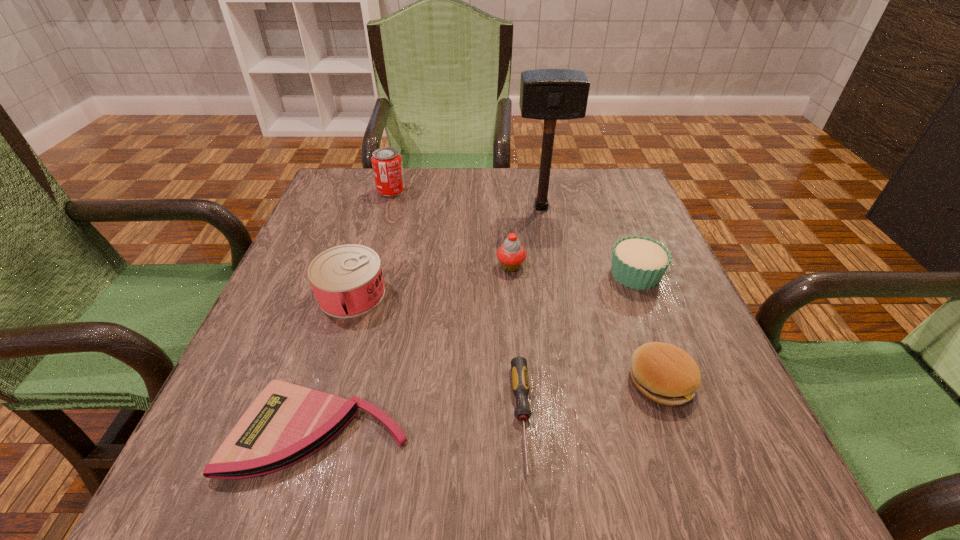
Where is `the tallest object`? the tallest object is located at coordinates (545, 94).

This screenshot has height=540, width=960. Find the location of `mallet`. mallet is located at coordinates (545, 94).

Find the location of `the seventh shortest object`. the seventh shortest object is located at coordinates (387, 165).

Locate an element on the screen. the taller can is located at coordinates (387, 165).

This screenshot has width=960, height=540. I want to click on the taller cupcake, so click(511, 254).

At what (x,y) coordinates should I click in order to perform the action: click on the nearer can. Please return your answer as a coordinate pair (x, y). Looking at the image, I should click on (347, 281).

At what (x,y) coordinates should I click in order to perform the action: click on the right cupcake. Please return your answer as a coordinate pair (x, y). Looking at the image, I should click on (638, 262).

You are a GUI agent. You are given a task and a screenshot of the screen. Output one action in this format:
    pyautogui.click(x=<x>, y=<y>)
    Task: Click on the patty
    Image resolution: width=960 pixels, height=540 pixels.
    Given the screenshot: What is the action you would take?
    pyautogui.click(x=663, y=373)

Where is `wristlet`? wristlet is located at coordinates (286, 423).

This screenshot has height=540, width=960. I want to click on screwdriver, so click(520, 383).